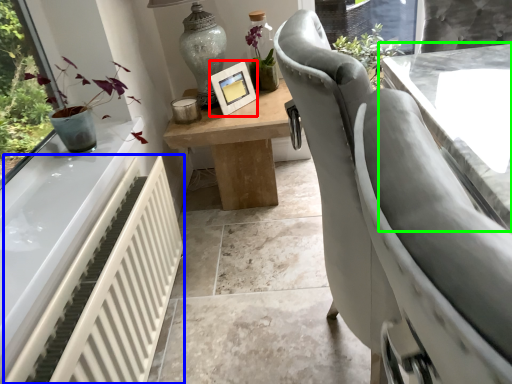
Question: Considering the real-world distances, which object is farthest from picture frame (highlighted by a red box)? radiator (highlighted by a blue box) or table (highlighted by a green box)?

Choices:
 (A) radiator
 (B) table

Answer: (A)